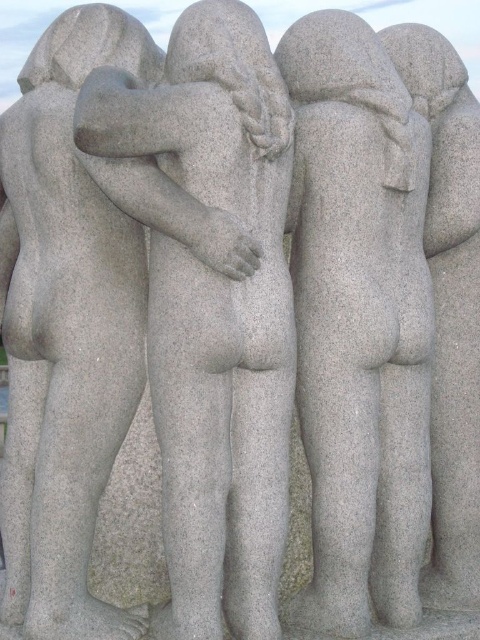
You are an art student standing in front of the monument. You want to sketch the statues. Which statue, the gray granite statue at center or the gray granite statue at left, is closer to you?

The gray granite statue at center is closer to you because it is further to the viewer than the gray granite statue at left.

You are an art student observing the sculptures. You notice the gray stone statue at center and the gray granite statue at left. Which statue is positioned lower in the image?

The gray stone statue at center is positioned lower than the gray granite statue at left.